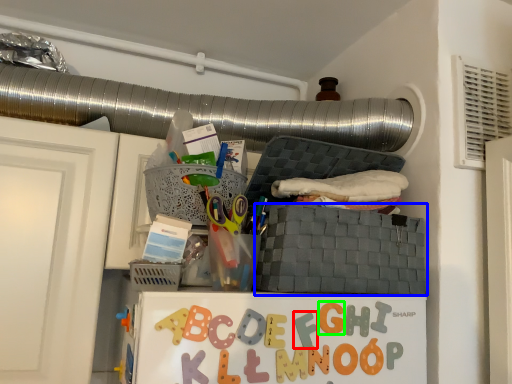
Question: Based on their relative distances, which object is nearer to alphabet (highlighted by a red box)? Choose from basket (highlighted by a blue box) and letter (highlighted by a green box).

Choices:
 (A) basket
 (B) letter

Answer: (B)